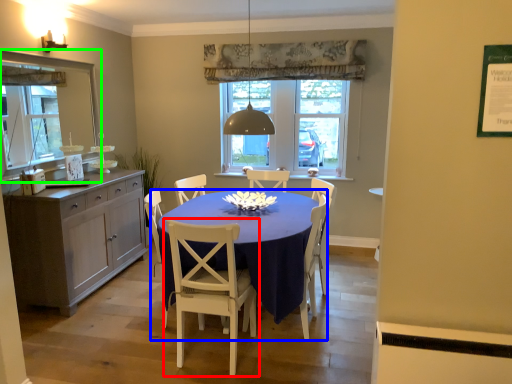
Question: Which object is positioned closest to chair (highlighted by a red box)? Select from desk (highlighted by a blue box) and mirror (highlighted by a green box).

Choices:
 (A) desk
 (B) mirror

Answer: (A)